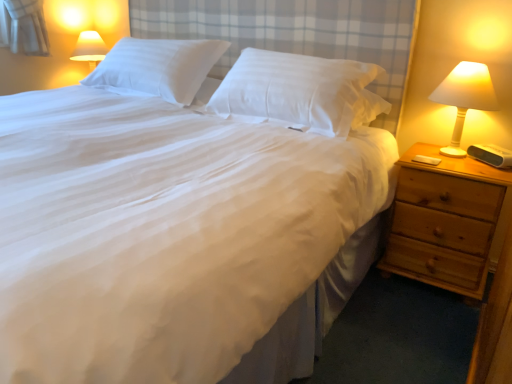
Question: Is the position of white smooth pillow at center, the 2th pillow from the left, less distant than that of white smooth pillow at upper center, the first pillow from the left?

Choices:
 (A) yes
 (B) no

Answer: (A)

Question: Is the surface of white smooth pillow at center, which is counted as the first pillow, starting from the right, in direct contact with white smooth pillow at upper center, the first pillow from the left?

Choices:
 (A) yes
 (B) no

Answer: (B)

Question: Is white smooth pillow at center, which is counted as the first pillow, starting from the right, oriented towards white smooth pillow at upper center, the first pillow from the left?

Choices:
 (A) no
 (B) yes

Answer: (A)

Question: From a real-world perspective, is white smooth pillow at center, the 2th pillow from the left, on top of white smooth pillow at upper center, the first pillow from the left?

Choices:
 (A) yes
 (B) no

Answer: (B)

Question: Does white smooth pillow at center, which is counted as the first pillow, starting from the right, appear on the left side of white smooth pillow at upper center, the 2th pillow in the right-to-left sequence?

Choices:
 (A) no
 (B) yes

Answer: (A)

Question: Considering the positions of light brown wooden nightstand at right and white plastic lamp at right in the image, is light brown wooden nightstand at right wider or thinner than white plastic lamp at right?

Choices:
 (A) thin
 (B) wide

Answer: (B)

Question: From the image's perspective, is light brown wooden nightstand at right positioned above or below white plastic lamp at right?

Choices:
 (A) above
 (B) below

Answer: (B)

Question: Does point (448, 225) appear closer or farther from the camera than point (477, 69)?

Choices:
 (A) closer
 (B) farther

Answer: (B)

Question: From their relative heights in the image, would you say light brown wooden nightstand at right is taller or shorter than white plastic lamp at right?

Choices:
 (A) tall
 (B) short

Answer: (A)

Question: In terms of width, does white smooth pillow at upper center, the first pillow from the left, look wider or thinner when compared to light brown wooden nightstand at right?

Choices:
 (A) thin
 (B) wide

Answer: (A)

Question: From the image's perspective, is white smooth pillow at upper center, the first pillow from the left, positioned above or below light brown wooden nightstand at right?

Choices:
 (A) above
 (B) below

Answer: (A)

Question: In the image, is white smooth pillow at upper center, the first pillow from the left, positioned in front of or behind light brown wooden nightstand at right?

Choices:
 (A) front
 (B) behind

Answer: (B)

Question: From a real-world perspective, relative to light brown wooden nightstand at right, is white smooth pillow at upper center, the 2th pillow in the right-to-left sequence, vertically above or below?

Choices:
 (A) above
 (B) below

Answer: (A)

Question: Is white smooth pillow at center, the 2th pillow from the left, inside the boundaries of white smooth pillow at upper center, the 2th pillow in the right-to-left sequence, or outside?

Choices:
 (A) outside
 (B) inside

Answer: (A)

Question: Considering the positions of white smooth pillow at center, which is counted as the first pillow, starting from the right, and white smooth pillow at upper center, the first pillow from the left, in the image, is white smooth pillow at center, which is counted as the first pillow, starting from the right, wider or thinner than white smooth pillow at upper center, the first pillow from the left,?

Choices:
 (A) wide
 (B) thin

Answer: (B)